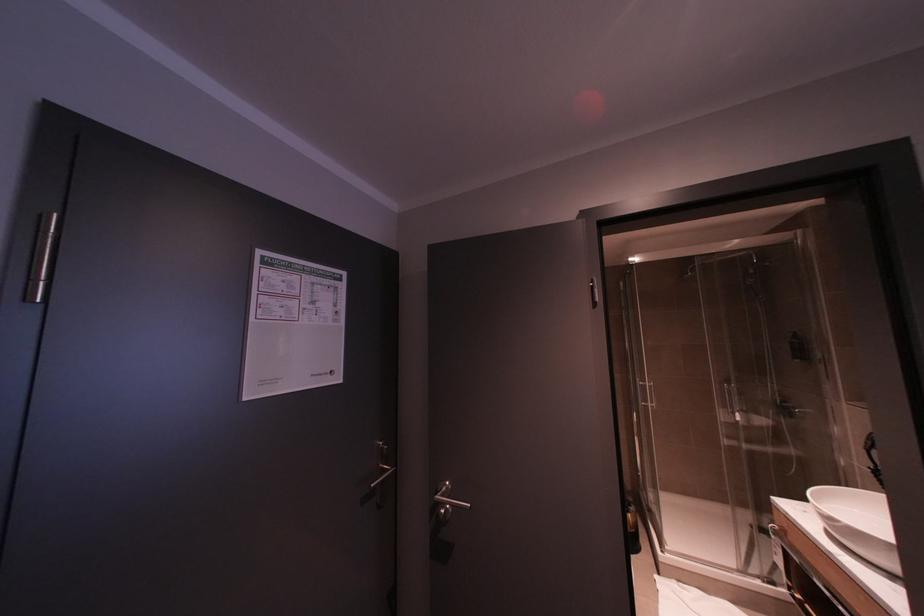
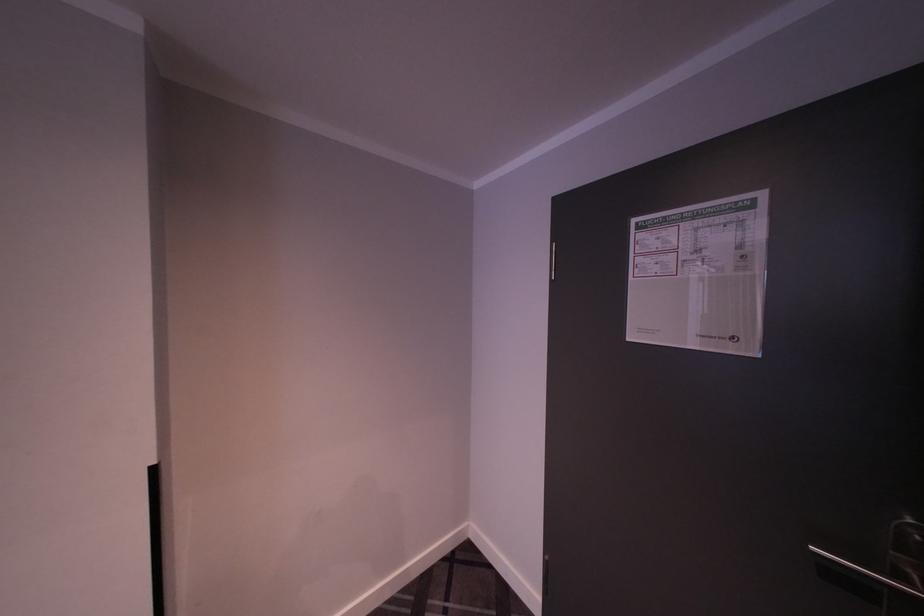
Question: How did the camera likely rotate?

Choices:
 (A) Left
 (B) Right
 (C) Up
 (D) Down

Answer: (A)